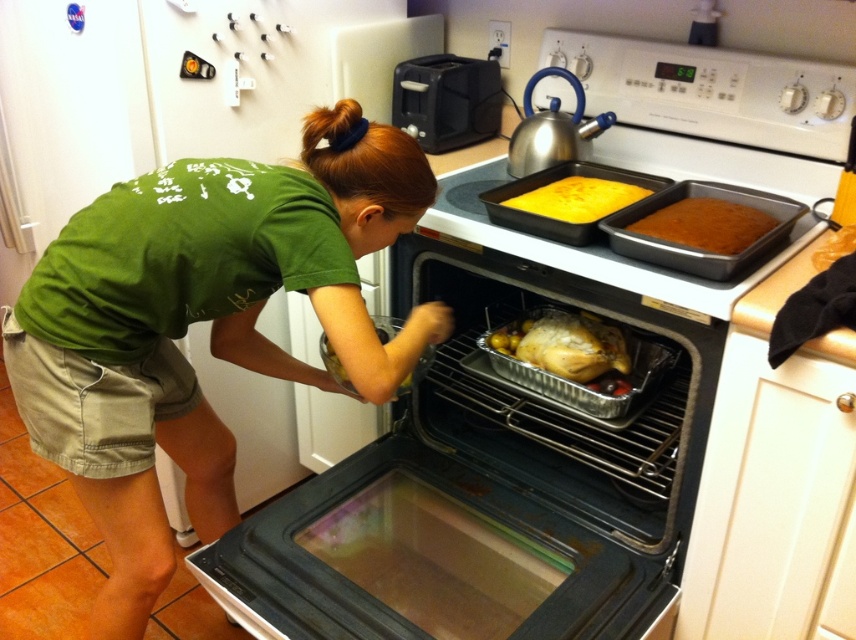
Question: Which object appears farthest from the camera in this image?

Choices:
 (A) golden brown roasted chicken at center
 (B) yellow matte cake at upper center

Answer: (B)

Question: Is silver metallic turkey at center closer to camera compared to brown matte cake at upper right?

Choices:
 (A) no
 (B) yes

Answer: (A)

Question: Which object is closer to the camera taking this photo?

Choices:
 (A) yellow matte cake at upper center
 (B) golden brown roasted chicken at center
 (C) brown matte cake at upper right
 (D) silver metallic turkey at center

Answer: (C)

Question: Considering the relative positions of yellow matte cake at upper center and golden brown roasted chicken at center in the image provided, where is yellow matte cake at upper center located with respect to golden brown roasted chicken at center?

Choices:
 (A) left
 (B) right

Answer: (B)

Question: Which is farther from the silver metallic turkey at center?

Choices:
 (A) golden brown roasted chicken at center
 (B) yellow matte cake at upper center
 (C) brown matte cake at upper right

Answer: (A)

Question: Is brown matte cake at upper right above golden brown roasted chicken at center?

Choices:
 (A) no
 (B) yes

Answer: (B)